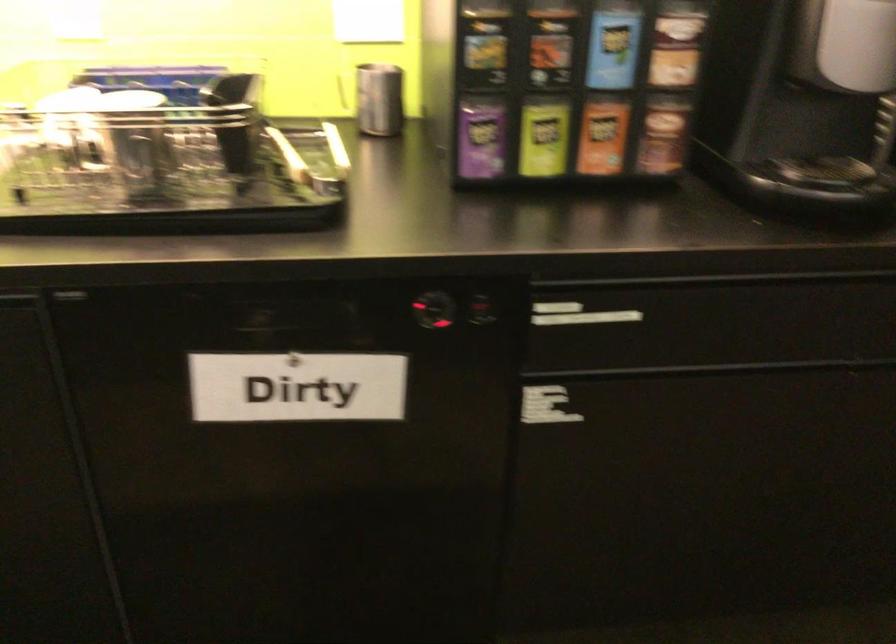
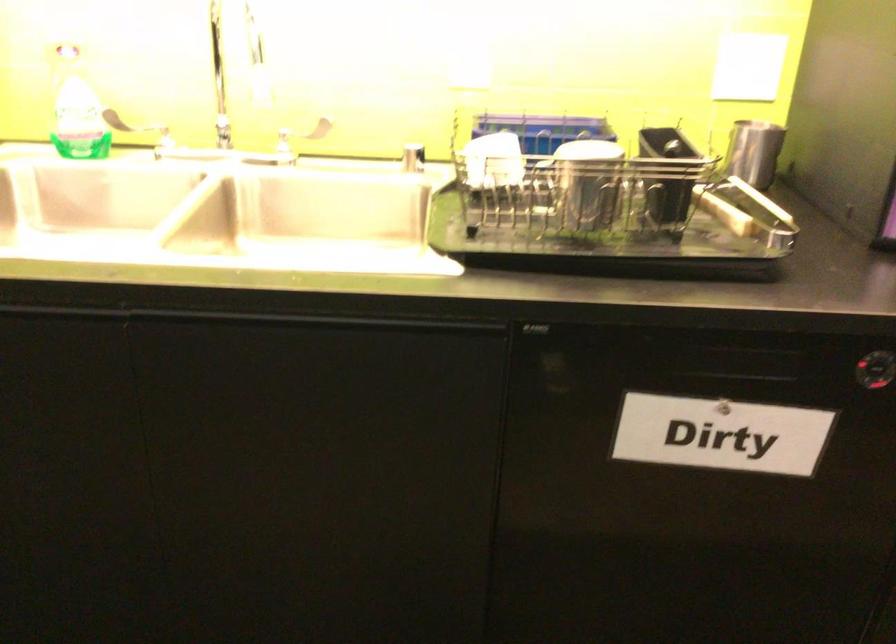
Question: How did the camera likely rotate?

Choices:
 (A) Left
 (B) Right
 (C) Up
 (D) Down

Answer: (A)